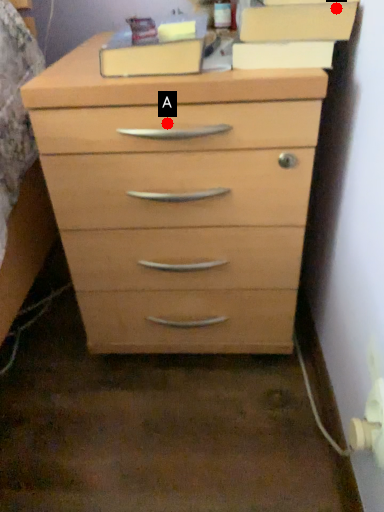
Question: Two points are circled on the image, labeled by A and B beside each circle. Among these points, which one is farthest from the camera?

Choices:
 (A) A is further
 (B) B is further

Answer: (A)